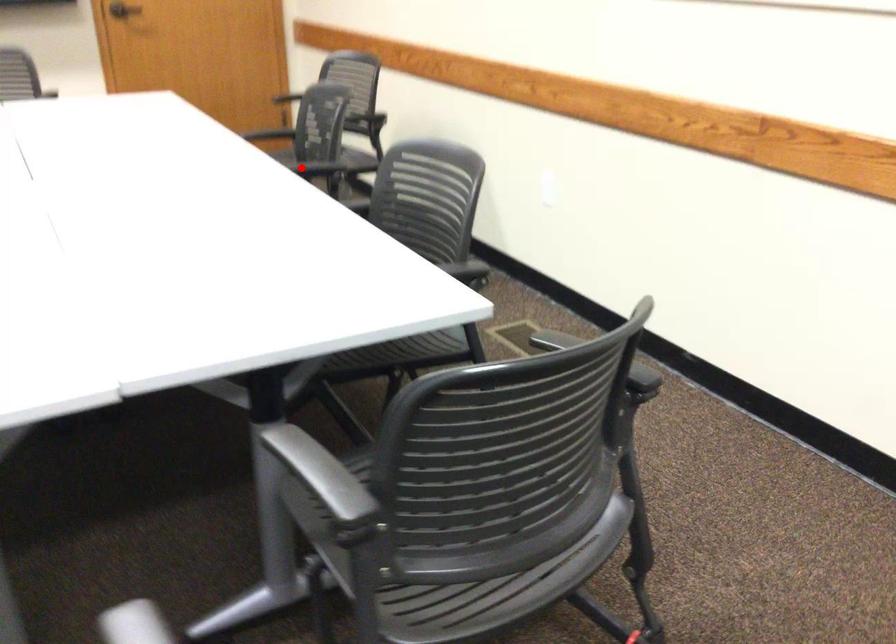
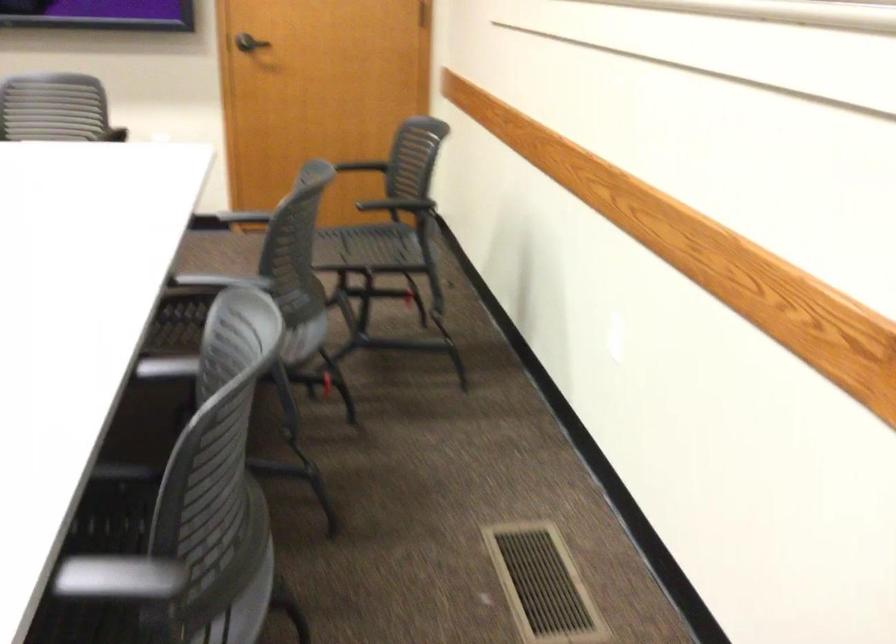
Question: A red point is marked in image1. In image2, is the corresponding 3D point closer to the camera or farther? Reply with the corresponding letter.

Choices:
 (A) The corresponding 3D point is closer.
 (B) The corresponding 3D point is farther.

Answer: (A)